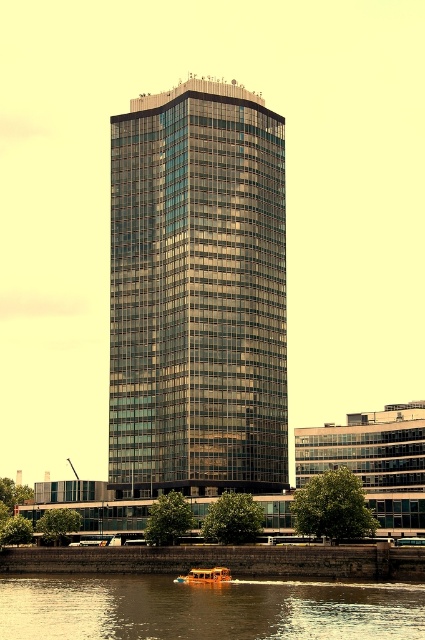
You are standing on the stone embankment near the water and want to take a photo of the glassy metallic skyscraper at center. Considering the distance, would you need a zoom lens to capture the entire building in the frame?

The glassy metallic skyscraper at center is 102.18 meters away from the viewer. A zoom lens would be necessary to capture the entire building in the frame from that distance.

You are standing at the point marked by the coordinates (x=198, y=292) in the image. What object is exactly at your current location?

The glassy metallic skyscraper at center is located at point (x=198, y=292), so the object at your current location is the glassy metallic skyscraper at center.

You are a boat operator who needs to navigate the orange polished wood boat at lower center through a narrow channel. The channel is only as wide as the brown water at lower center. Will the boat fit through the channel?

The brown water at lower center might be wider than orange polished wood boat at lower center, so there is a possibility that the boat could fit through the channel if the water width is indeed greater. However, since the exact dimensions are uncertain, caution is advised to avoid potential collisions.